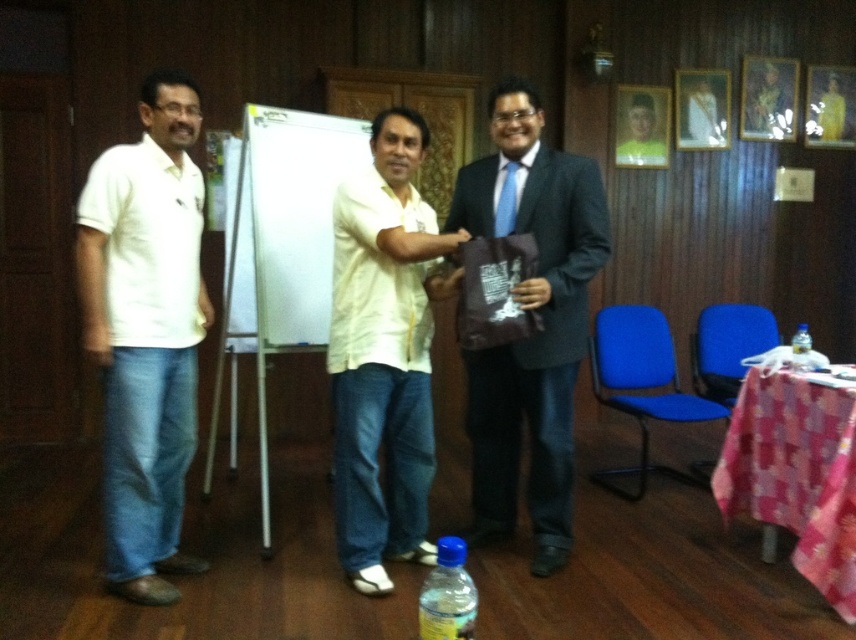
Question: Which is nearer to the whiteboard at center?

Choices:
 (A) translucent plastic bottle at center
 (B) white cotton shirt at left

Answer: (B)

Question: Estimate the real-world distances between objects in this image. Which object is farther from the translucent plastic bottle at center?

Choices:
 (A) light yellow shirt at center
 (B) matte brown bag at center

Answer: (A)

Question: Is light yellow shirt at center smaller than translucent plastic bottle at center?

Choices:
 (A) no
 (B) yes

Answer: (A)

Question: Does matte brown bag at center have a larger size compared to whiteboard at center?

Choices:
 (A) no
 (B) yes

Answer: (A)

Question: Observing the image, what is the correct spatial positioning of light yellow shirt at center in reference to translucent plastic bottle at lower center?

Choices:
 (A) above
 (B) below

Answer: (A)

Question: Estimate the real-world distances between objects in this image. Which object is farther from the translucent plastic bottle at lower center?

Choices:
 (A) white cotton shirt at left
 (B) translucent plastic bottle at center

Answer: (B)